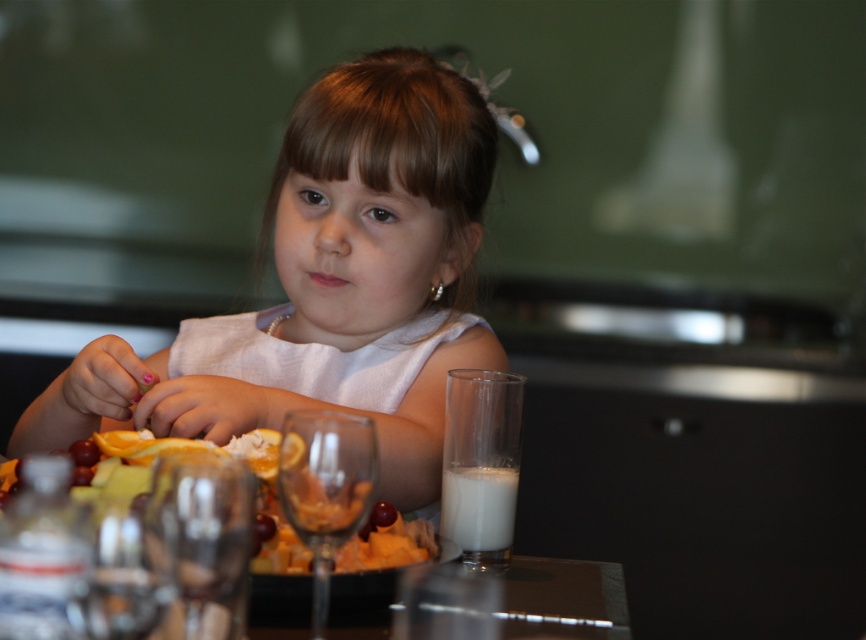
You are standing at the table where the young girl is sitting. There are two points marked on the table surface. The first point is at coordinates point (419,173) and the second is at point (501,556). If you were to walk around the table, which point would you encounter first when moving clockwise from the girl?

Point (501,556) would be encountered first when moving clockwise around the table because it is in front of point (419,173) according to their spatial relationship.

You are a parent trying to ensure your child stays hydrated. The white fabric child at center is drinking from the white opaque glass at lower right. Is the glass likely empty or full?

The white opaque glass at lower right is empty, so it is likely empty.